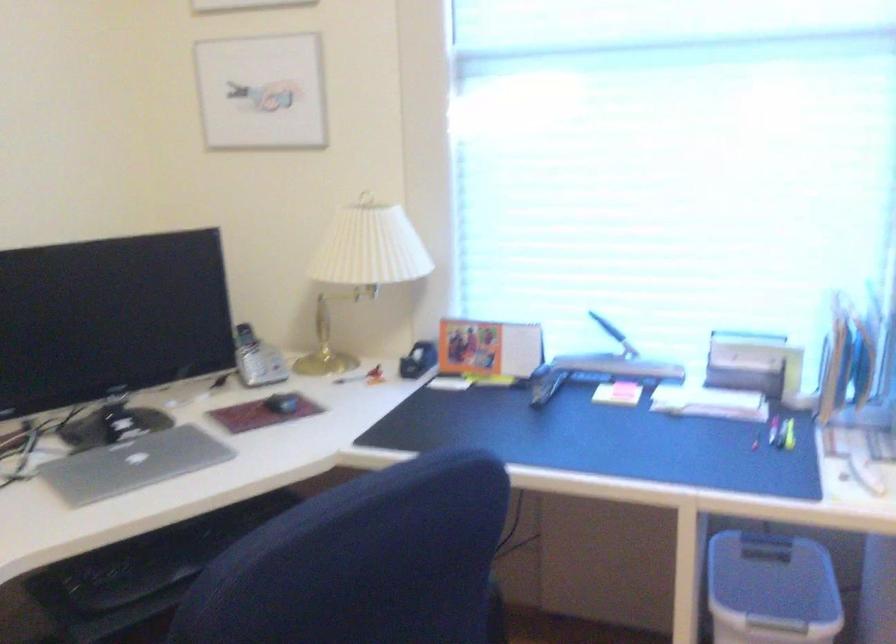
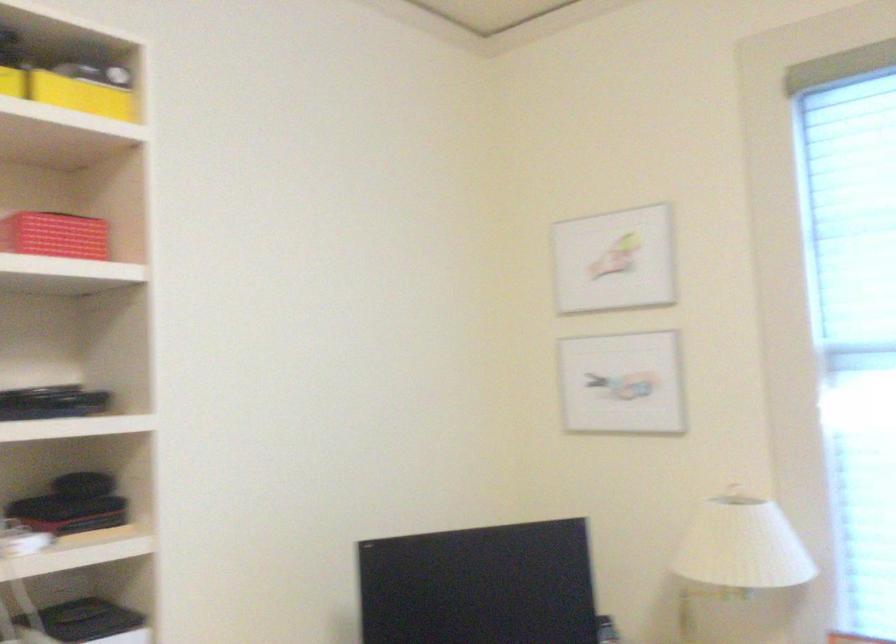
How did the camera likely rotate?

The camera rotated toward left-up.